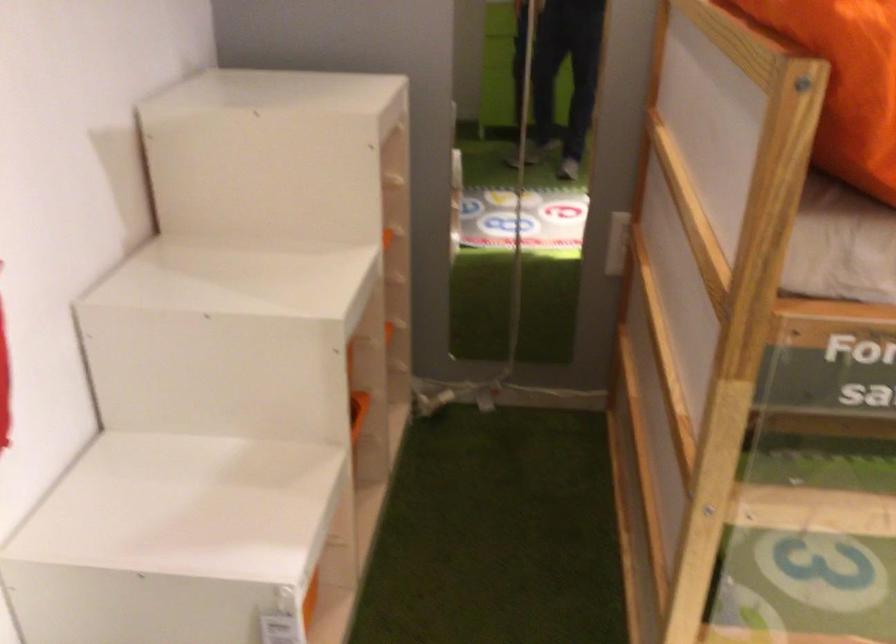
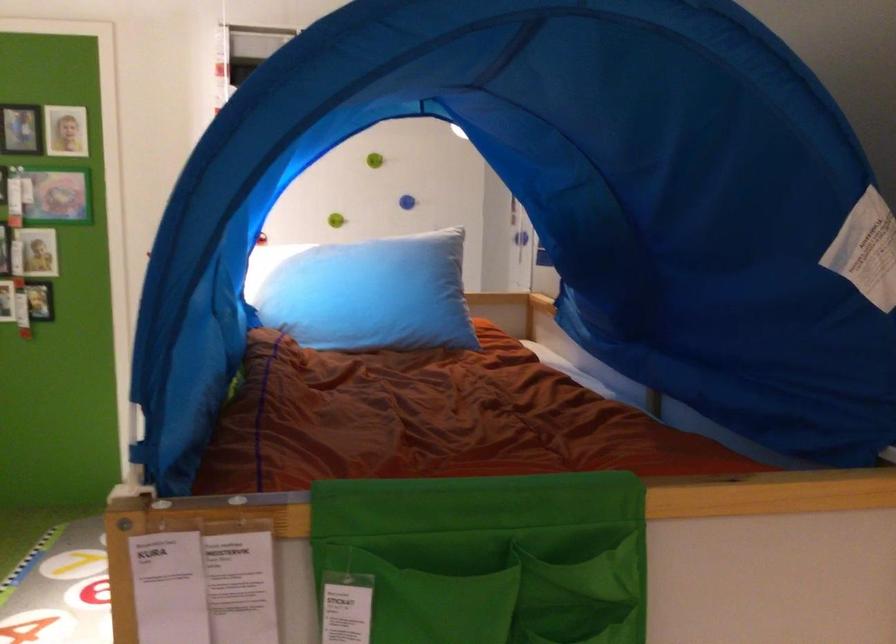
Question: I am providing you with two images of the same scene from different viewpoints. Please identify which objects are invisible in image2.

Choices:
 (A) large grey pot
 (B) blue wall knob
 (C) small picture frame
 (D) orange storage bin

Answer: (D)